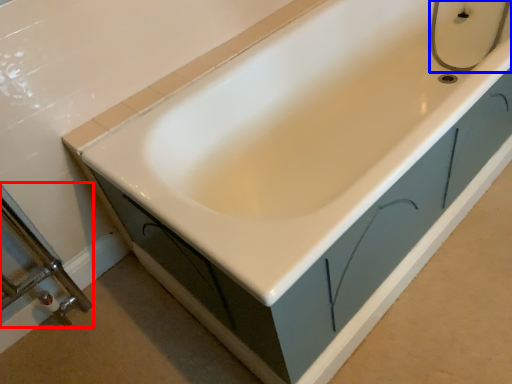
Question: Which object is closer to the camera taking this photo, shower door (highlighted by a red box) or plumbing fixture (highlighted by a blue box)?

Choices:
 (A) shower door
 (B) plumbing fixture

Answer: (A)